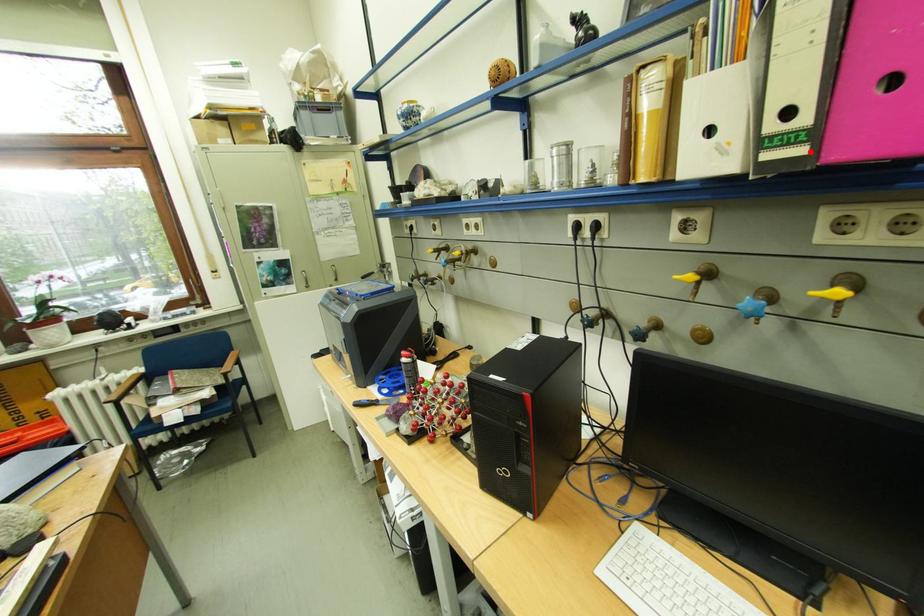
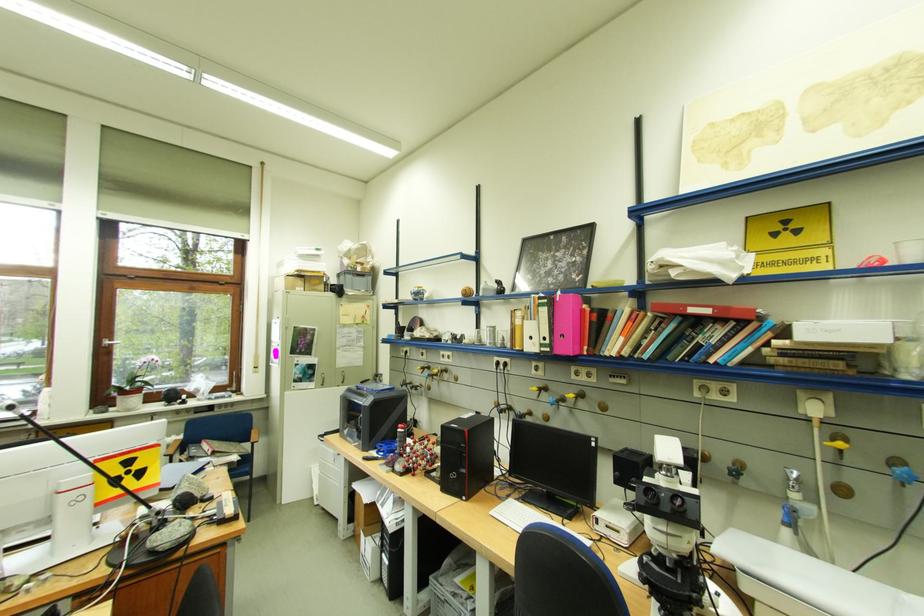
Where in the second image is the point corresponding to the highlighted location from the first image?

(558, 351)